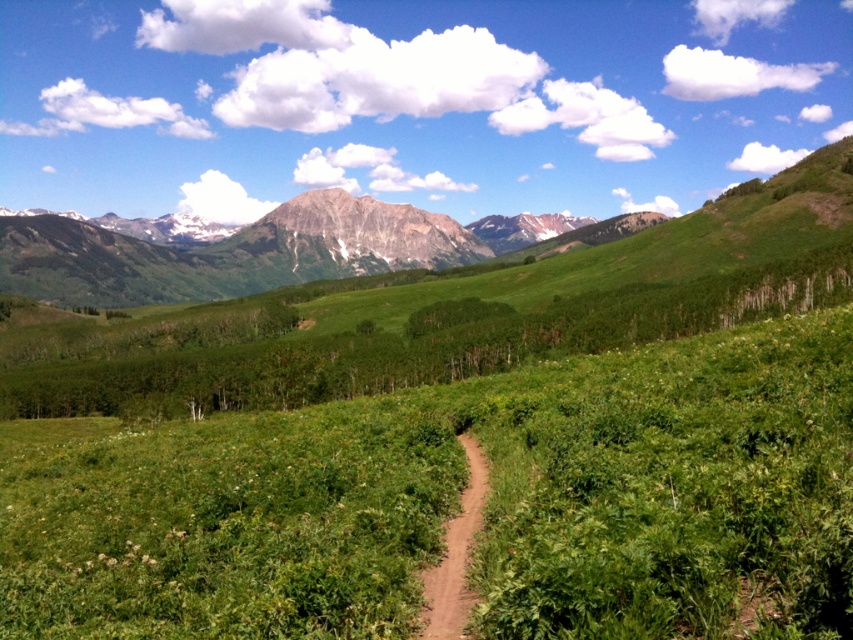
Question: Is green leafy grass at center positioned before rustic granite mountain at center?

Choices:
 (A) yes
 (B) no

Answer: (A)

Question: Based on their relative distances, which object is nearer to the rustic granite mountain at center?

Choices:
 (A) green leafy grass at center
 (B) brown dirt path at center

Answer: (A)

Question: Which point is closer to the camera?

Choices:
 (A) rustic granite mountain at center
 (B) brown dirt path at center

Answer: (B)

Question: Does green leafy grass at center appear on the left side of brown dirt path at center?

Choices:
 (A) yes
 (B) no

Answer: (A)

Question: Which point is farther to the camera?

Choices:
 (A) green leafy grass at center
 (B) brown dirt path at center

Answer: (B)

Question: Is green leafy grass at center in front of brown dirt path at center?

Choices:
 (A) no
 (B) yes

Answer: (B)